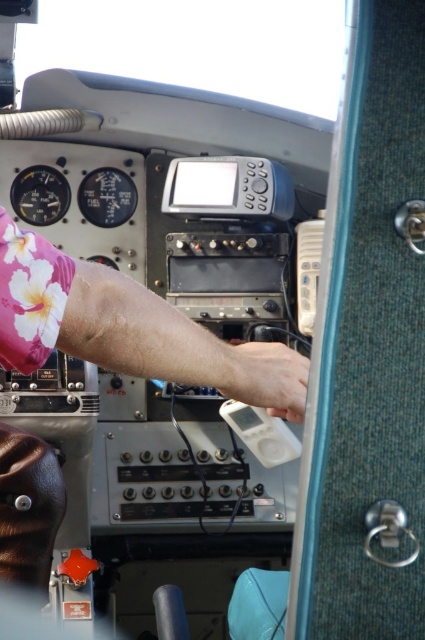
Question: Which of the following is the farthest from the observer?

Choices:
 (A) white matte hand at center
 (B) pink floral fabric at center

Answer: (A)

Question: Is pink floral fabric at center behind white matte hand at center?

Choices:
 (A) no
 (B) yes

Answer: (A)

Question: Which object is farther from the camera taking this photo?

Choices:
 (A) white matte hand at center
 (B) pink floral fabric at center

Answer: (A)

Question: Can you confirm if pink floral fabric at center is positioned above white matte hand at center?

Choices:
 (A) no
 (B) yes

Answer: (B)

Question: Can you confirm if pink floral fabric at center is positioned above white matte hand at center?

Choices:
 (A) no
 (B) yes

Answer: (B)